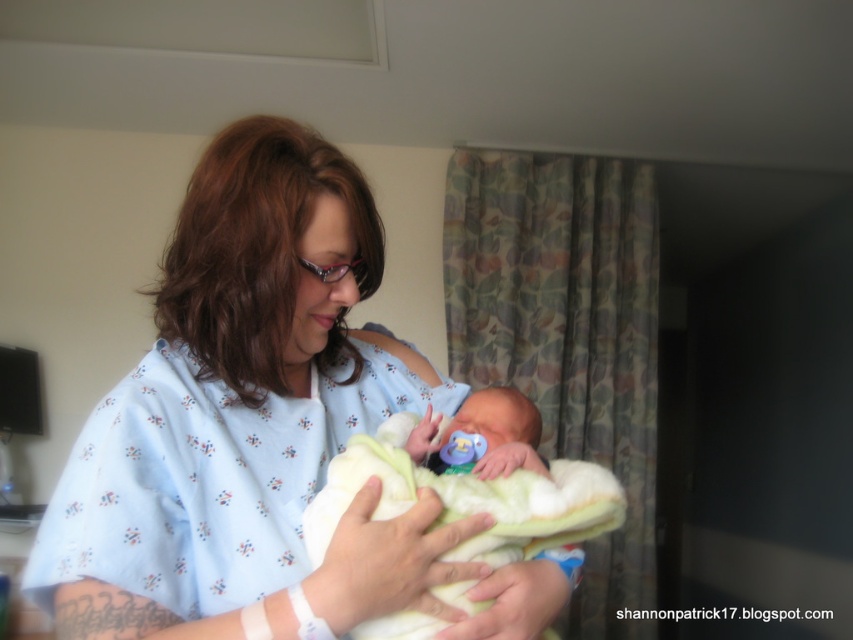
Is white soft blanket at center bigger than smooth white blanket at center?

Indeed, white soft blanket at center has a larger size compared to smooth white blanket at center.

Image resolution: width=853 pixels, height=640 pixels. Describe the element at coordinates (485, 433) in the screenshot. I see `white soft blanket at center` at that location.

Measure the distance between white soft blanket at center and camera.

white soft blanket at center and camera are 27.34 inches apart from each other.

At what (x,y) coordinates should I click in order to perform the action: click on white soft blanket at center. Please return your answer as a coordinate pair (x, y). The height and width of the screenshot is (640, 853). Looking at the image, I should click on (485, 433).

Identify the location of blue floral hospital gown at center. This screenshot has width=853, height=640. (258, 428).

Does point (350, 189) lie behind point (521, 572)?

Yes, it is.

This screenshot has width=853, height=640. I want to click on blue floral hospital gown at center, so click(258, 428).

This screenshot has height=640, width=853. Find the location of `blue floral hospital gown at center`. blue floral hospital gown at center is located at coordinates (258, 428).

Which is more to the left, blue floral hospital gown at center or smooth white blanket at center?

Positioned to the left is blue floral hospital gown at center.

Between point (339, 282) and point (505, 452), which one is positioned in front?

Point (339, 282)

I want to click on blue floral hospital gown at center, so click(258, 428).